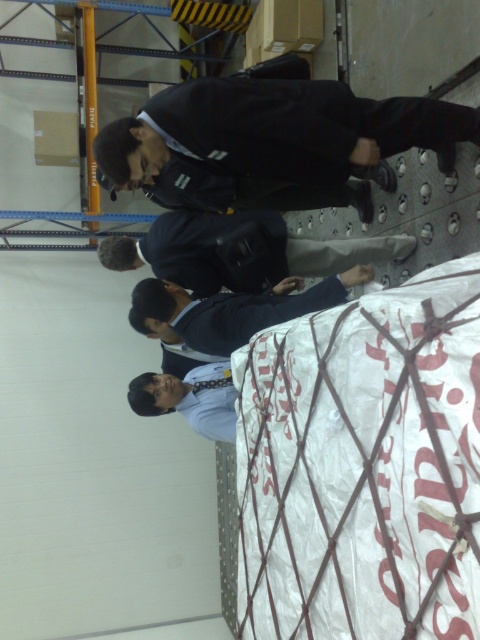
You are an inventory manager in the warehouse and need to place a new item on the shelf. The shelf has a maximum weight capacity of 50 kg. The black matte suit at center is currently placed at point 0.223, 0.569. Can you determine if the new item can be placed there safely?

The black matte suit at center is located at point (273, 141). However, the weight of the suit or the current load at that point is not provided. Therefore, it is impossible to determine if placing the new item there would exceed the shelf capacity without additional information.

You are standing at the origin point in the warehouse. Where is the dark blue suit at center located in terms of coordinates?

The dark blue suit at center is located at coordinates point (220, 262).

You are a tailor observing two suits in a warehouse. The black matte suit at center and the dark blue suit at center. Which suit has a narrower width?

The black matte suit at center is thinner than the dark blue suit at center, so the black matte suit at center has a narrower width.